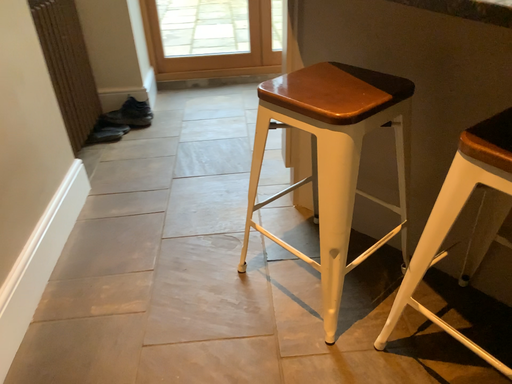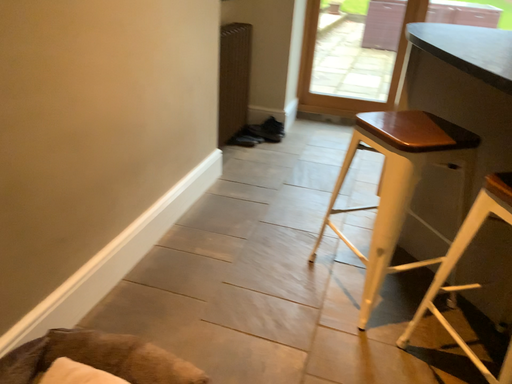
Question: How did the camera likely rotate when shooting the video?

Choices:
 (A) rotated left
 (B) rotated right

Answer: (A)